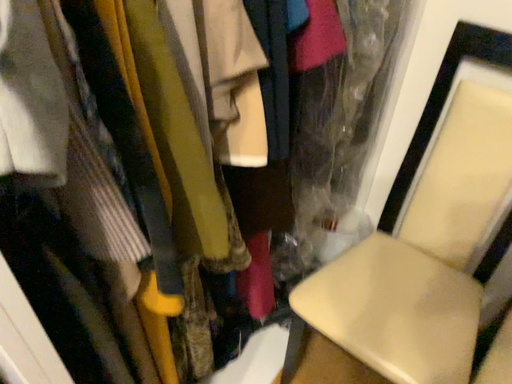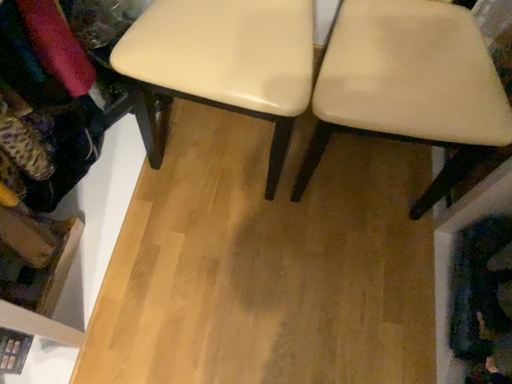
Question: How did the camera likely rotate when shooting the video?

Choices:
 (A) rotated upward
 (B) rotated downward

Answer: (B)